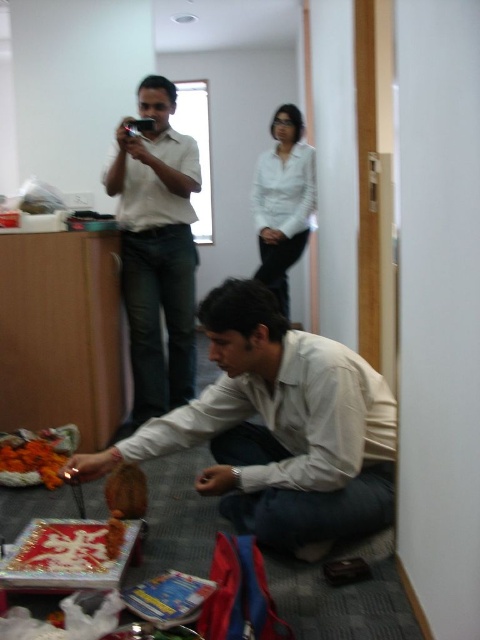
You are standing in an office and see a point marked at coordinates (278,428). According to the scene description, what object is located at this point?

The point at coordinates (278,428) is located on the matte white shirt at lower center.

You are standing in the office scene and want to pick up an object. If you look at the point labeled as point (x=145, y=289) and the point labeled as point (x=34, y=440), which point is closer to you?

Point (x=145, y=289) is further to the camera than point (x=34, y=440), so the point closer to you is point (x=34, y=440).